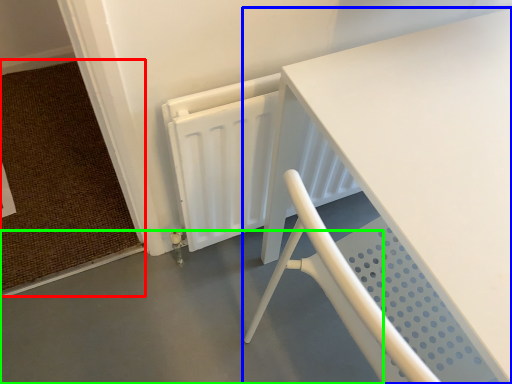
Question: Which is nearer to the doormat (highlighted by a red box)? table (highlighted by a blue box) or concrete (highlighted by a green box).

Choices:
 (A) table
 (B) concrete

Answer: (B)